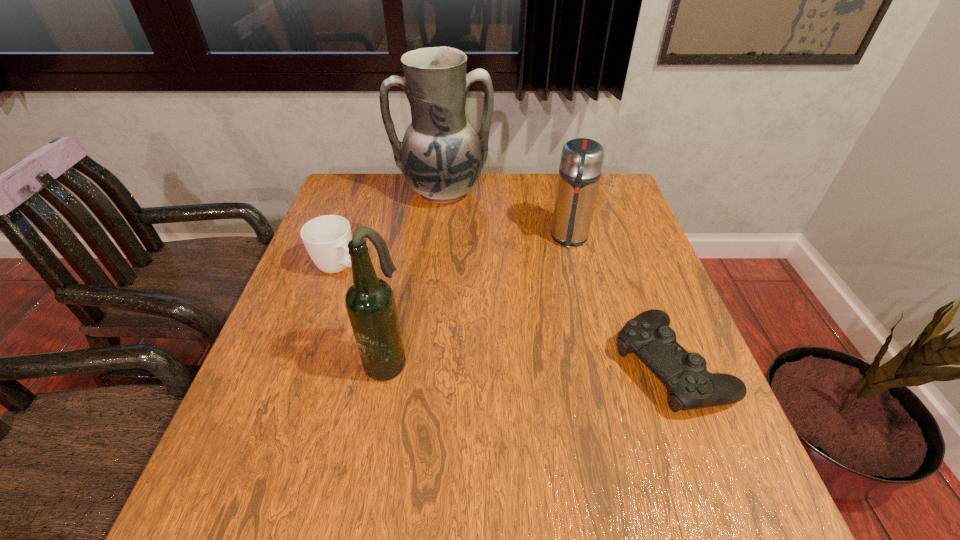
Identify the location of vacant space located with a handle on the side of the thermos bottle. The image size is (960, 540). (564, 291).

This screenshot has width=960, height=540. What are the coordinates of `vacant area situated 0.170m with a handle on the side of the thermos bottle` in the screenshot? It's located at (563, 296).

This screenshot has width=960, height=540. I want to click on vacant space located with the handle on the side of the leftmost object, so click(x=423, y=318).

Find the location of `vacant space located 0.310m with the handle on the side of the leftmost object`. vacant space located 0.310m with the handle on the side of the leftmost object is located at coordinates (453, 336).

This screenshot has width=960, height=540. I want to click on vacant space located with the handle on the side of the leftmost object, so click(467, 345).

Where is `free space located on the front-facing side of the farthest object`? This screenshot has width=960, height=540. free space located on the front-facing side of the farthest object is located at coordinates (465, 266).

You are a GUI agent. You are given a task and a screenshot of the screen. Output one action in this format:
    pyautogui.click(x=<x>, y=<y>)
    Task: Click on the vacant point located 0.380m on the front-facing side of the farthest object
    
    Given the screenshot: What is the action you would take?
    pyautogui.click(x=475, y=305)

This screenshot has width=960, height=540. Identify the location of blank area located 0.170m on the front-facing side of the farthest object. (461, 249).

The height and width of the screenshot is (540, 960). In order to click on object that is at the far edge in this screenshot , I will do `click(441, 157)`.

Where is `object positioned at the near edge`? The width and height of the screenshot is (960, 540). object positioned at the near edge is located at coordinates (648, 335).